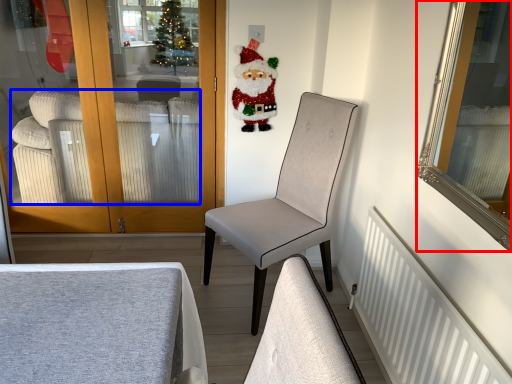
Question: Among these objects, which one is nearest to the camera, mirror (highlighted by a red box) or studio couch (highlighted by a blue box)?

Choices:
 (A) mirror
 (B) studio couch

Answer: (A)